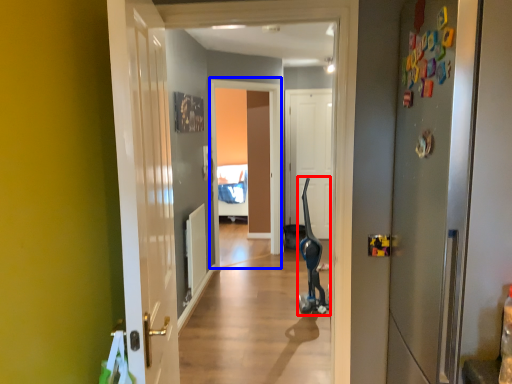
Question: Which object appears closest to the camera in this image, segway (highlighted by a red box) or screen door (highlighted by a blue box)?

Choices:
 (A) segway
 (B) screen door

Answer: (A)